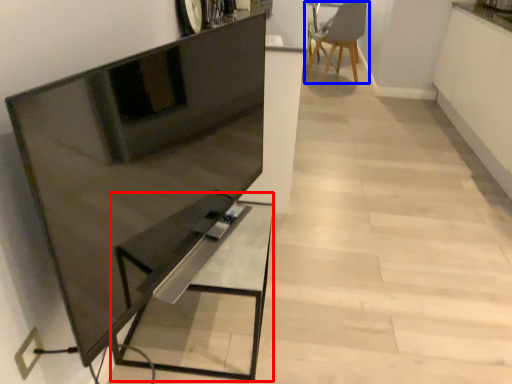
Question: Which of the following is the closest to the observer, table (highlighted by a red box) or chair (highlighted by a blue box)?

Choices:
 (A) table
 (B) chair

Answer: (A)